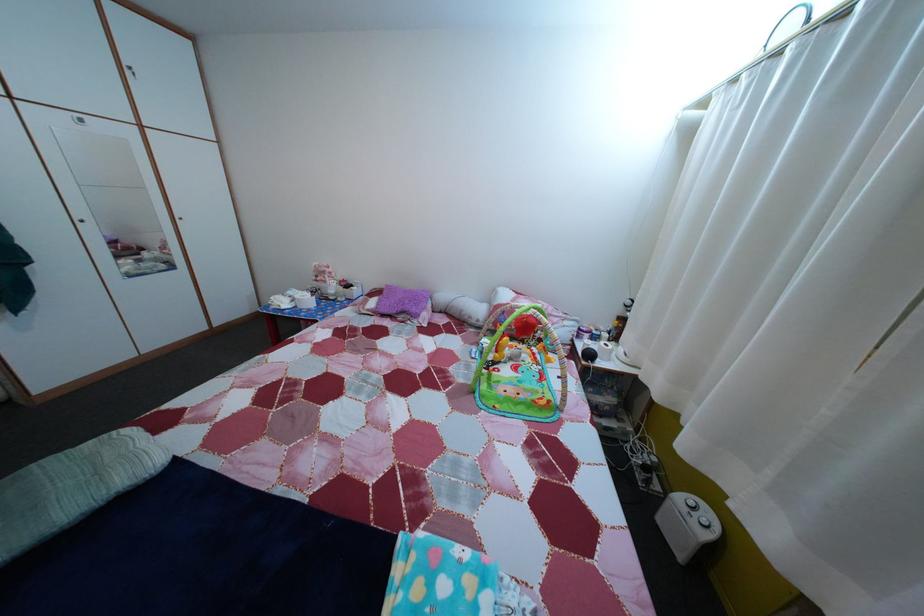
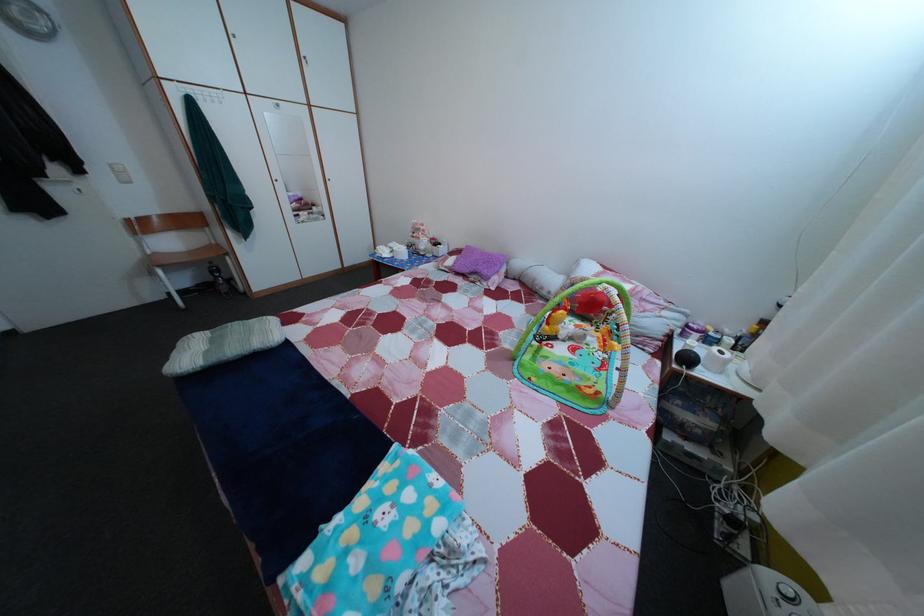
Where in the second image is the point corresponding to the point at 590,354 from the first image?

(687, 354)